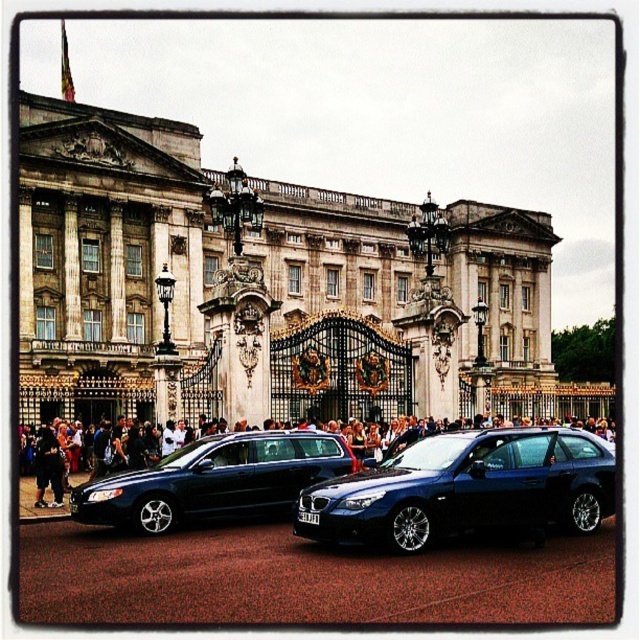
Which is above, shiny blue car at center or shiny black sedan at center?

shiny blue car at center is above.

Who is shorter, shiny blue car at center or shiny black sedan at center?

With less height is shiny black sedan at center.

The image size is (640, 640). Identify the location of shiny blue car at center. (465, 488).

Between stone marble palace at center and shiny black sedan at center, which one is positioned lower?

shiny black sedan at center

Does stone marble palace at center come behind shiny black sedan at center?

Yes, stone marble palace at center is further from the viewer.

Where is `stone marble palace at center`? stone marble palace at center is located at coordinates (109, 260).

Where is `stone marble palace at center`? This screenshot has width=640, height=640. stone marble palace at center is located at coordinates (109, 260).

In the scene shown: Can you confirm if stone marble palace at center is positioned to the right of shiny blue car at center?

Incorrect, stone marble palace at center is not on the right side of shiny blue car at center.

Between stone marble palace at center and shiny blue car at center, which one appears on the left side from the viewer's perspective?

From the viewer's perspective, stone marble palace at center appears more on the left side.

Which is behind, point (148, 163) or point (426, 458)?

Positioned behind is point (148, 163).

Where is `stone marble palace at center`? The image size is (640, 640). stone marble palace at center is located at coordinates (109, 260).